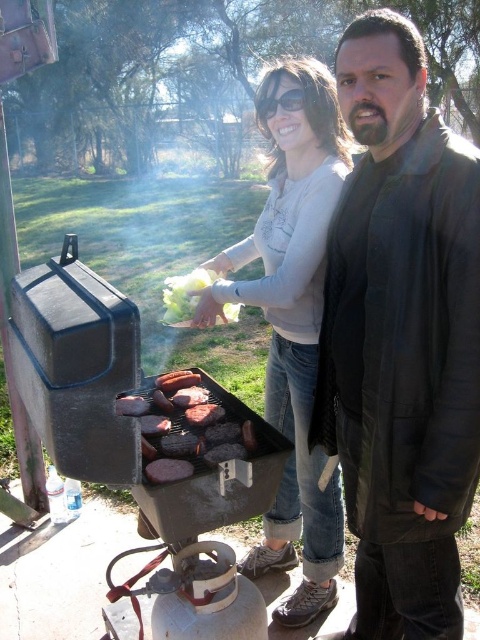
You are standing at point (291, 93) in the barbecue scene. There is another point at (216, 403). Which direction should you move to reach the point behind you?

Point (216, 403) is behind point (291, 93), so you should move backward to reach it.

You are a guest at this barbecue and want to know which item is wider between the charred meat at center and the black plastic sunglasses at upper center. Which one is wider?

The charred meat at center is wider than the black plastic sunglasses at upper center.